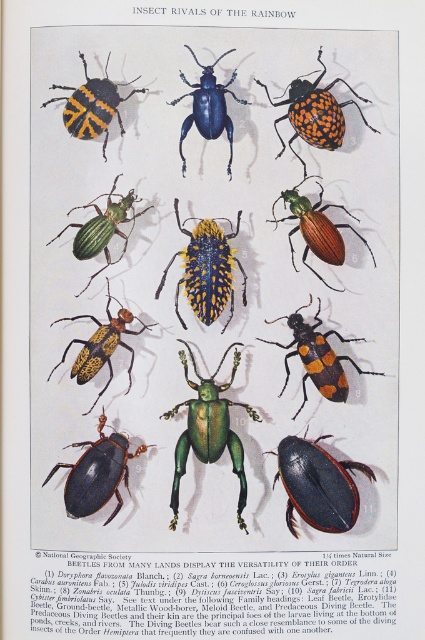
Question: Can you confirm if orange-yellow spotted beetle at center-right is bigger than green matte beetle at upper left?

Choices:
 (A) no
 (B) yes

Answer: (B)

Question: Is shiny black beetle at lower left to the left of yellow-orange speckled beetle at center-left from the viewer's perspective?

Choices:
 (A) no
 (B) yes

Answer: (A)

Question: Which point is farther to the camera?

Choices:
 (A) metallic green and orange beetle at center
 (B) yellow-spotted metallic beetle at center
 (C) yellow-orange speckled beetle at center-left
 (D) green matte beetle at upper left

Answer: (C)

Question: Which object is positioned farthest from the glossy blue beetle at center?

Choices:
 (A) green glossy beetle at center
 (B) matte black beetle at center
 (C) metallic green beetle at center

Answer: (C)

Question: Which is nearer to the yellow-spotted metallic beetle at center?

Choices:
 (A) glossy blue beetle at center
 (B) green glossy beetle at center

Answer: (B)

Question: Is yellow-spotted metallic beetle at center below orange-yellow spotted beetle at center?

Choices:
 (A) yes
 (B) no

Answer: (A)